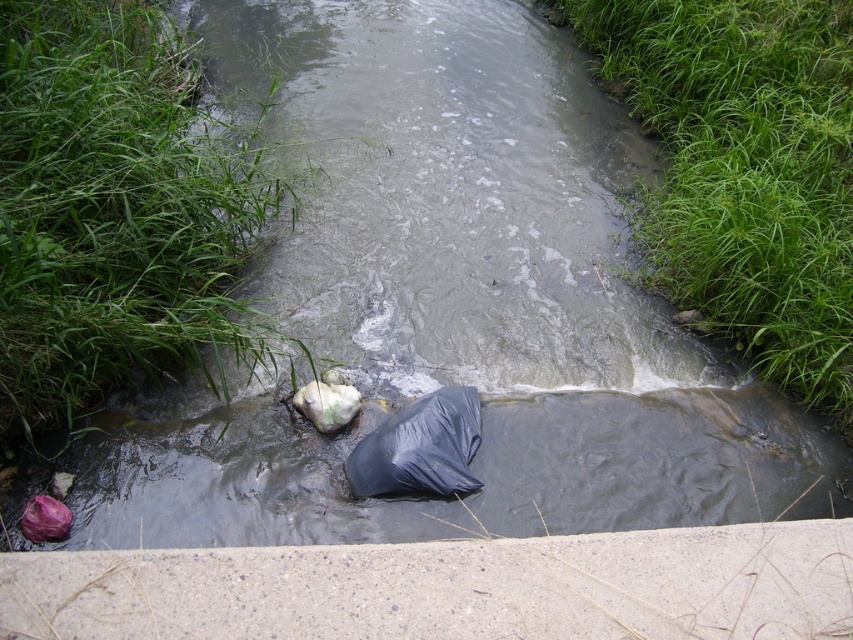
From the picture: You are standing at the edge of the stream and see the green grass at lower left and the black plastic bag at center. Which object is closer to your left side?

The green grass at lower left is closer to your left side because it is positioned to the left of the black plastic bag at center.

You are standing at the edge of the stream and want to place a small pebble between the green grass at lower left and the green grass at upper right. Which grass area is closer to you where you should aim to place the pebble?

The green grass at lower left is closer to the viewer, so you should aim to place the pebble there first as it is nearer than the green grass at upper right.